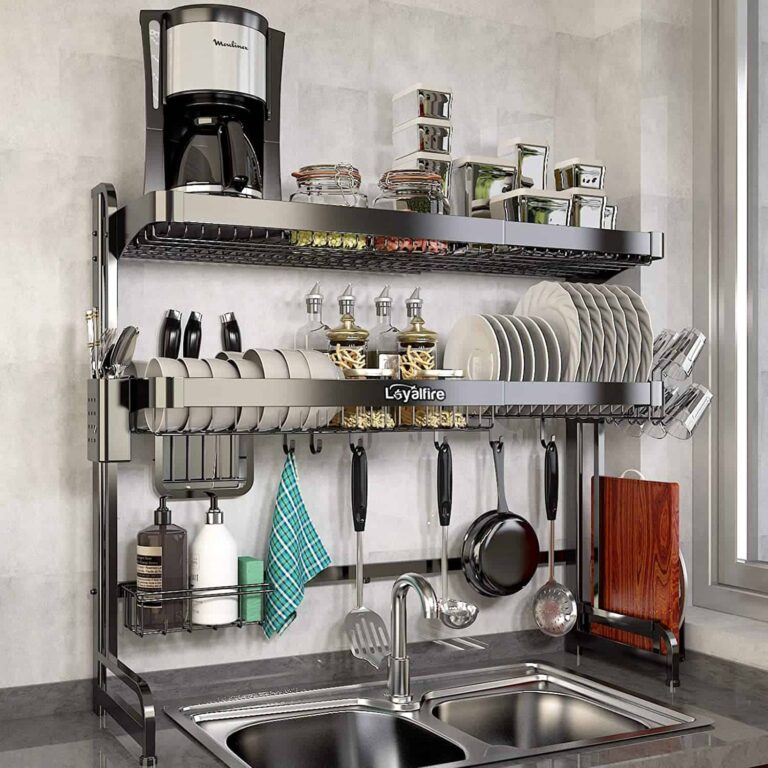
The image size is (768, 768). In order to click on sink in this screenshot , I will do `click(426, 720)`.